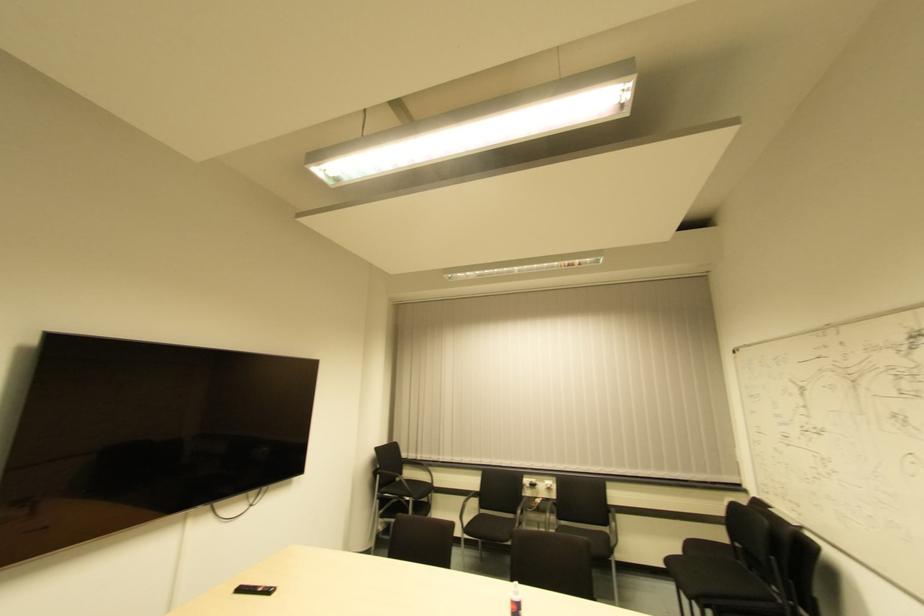
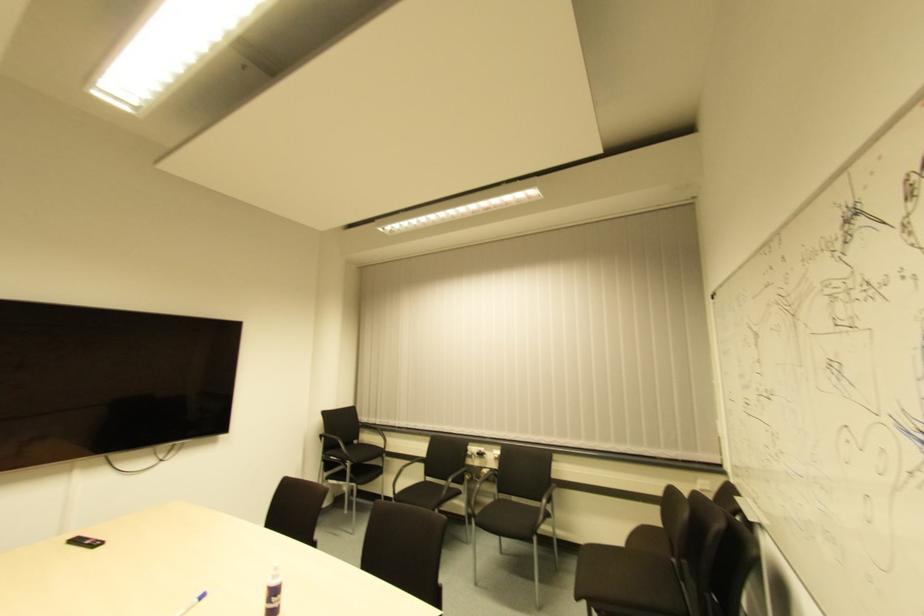
Find the pixel in the second image that matches (x=612, y=527) in the first image.

(542, 505)